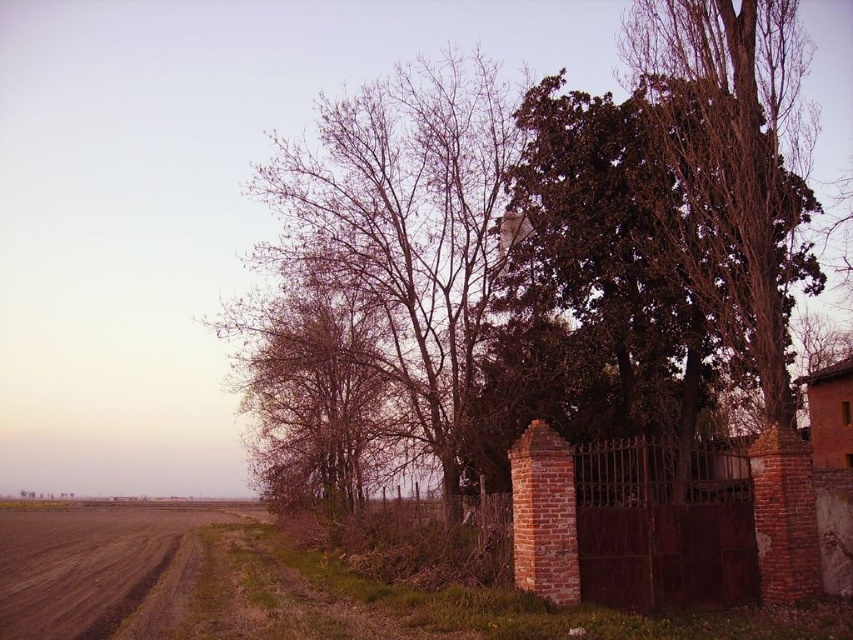
Is bare branches at center taller than brown dirt track at lower left?

Yes.

Identify the location of bare branches at center. The image size is (853, 640). (404, 236).